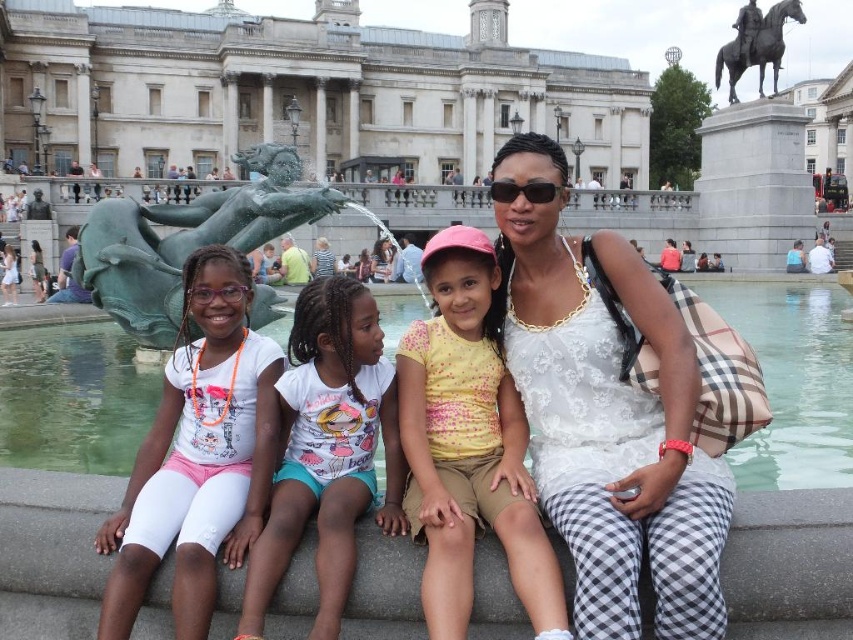
Question: Which point is farther from the camera taking this photo?

Choices:
 (A) (432, 260)
 (B) (735, 22)
 (C) (262, 232)

Answer: (B)

Question: Can you confirm if white matte t-shirt at center is thinner than yellow dotted shirt at center?

Choices:
 (A) yes
 (B) no

Answer: (A)

Question: Is green patina bronze mermaid at center below black polished metal horse at upper right?

Choices:
 (A) yes
 (B) no

Answer: (A)

Question: Is white lace dress at center positioned at the back of white cotton shirt at center?

Choices:
 (A) yes
 (B) no

Answer: (B)

Question: Which point appears closest to the camera in this image?

Choices:
 (A) (202, 195)
 (B) (283, 465)
 (C) (735, 93)
 (D) (200, 483)

Answer: (D)

Question: Considering the real-world distances, which object is farthest from the green patina bronze mermaid at center?

Choices:
 (A) black polished metal horse at upper right
 (B) yellow dotted shirt at center
 (C) white cotton shirt at center

Answer: (A)